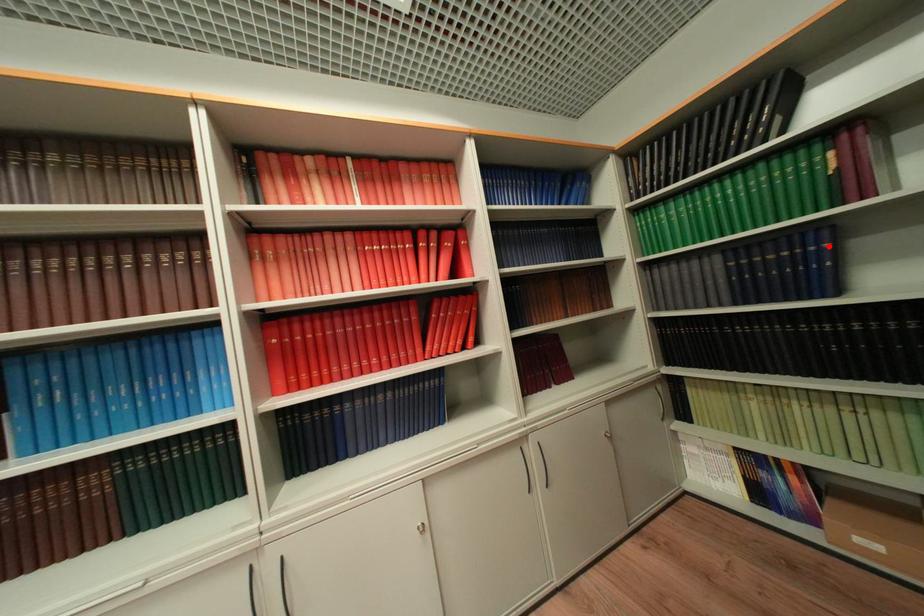
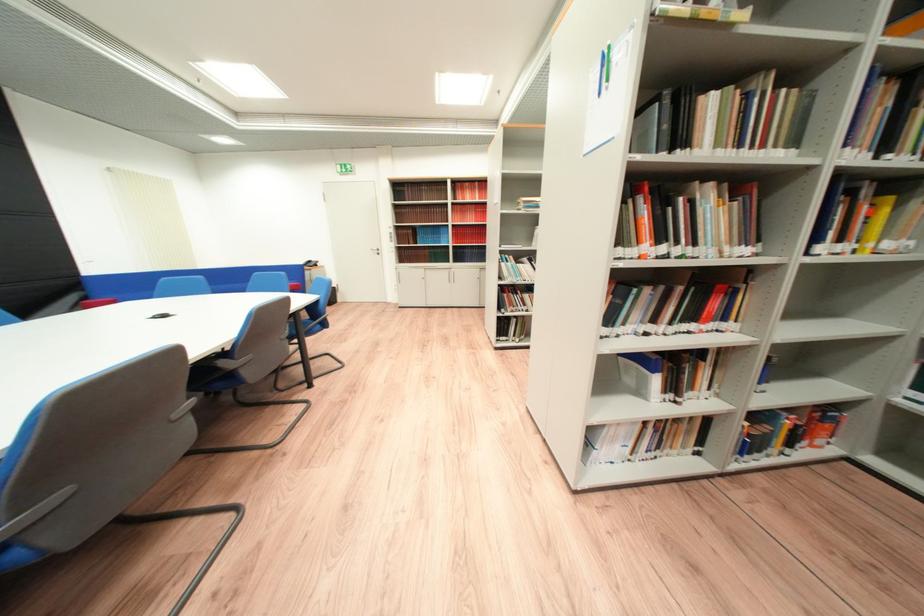
Question: I am providing you with two images of the same scene from different viewpoints. A red point is marked on the first image. At the location where the point appears in image 1, is it still visible in image 2?

Choices:
 (A) Yes
 (B) No

Answer: (B)